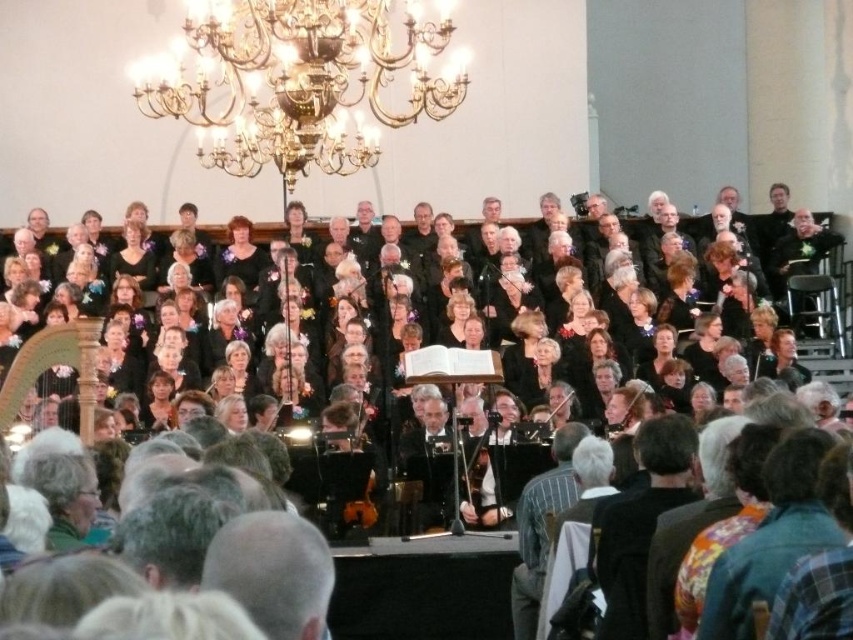
Is gold crystal chandelier at upper center taller than black leather jacket at upper center?

Correct, gold crystal chandelier at upper center is much taller as black leather jacket at upper center.

Is gold crystal chandelier at upper center bigger than black leather jacket at upper center?

Correct, gold crystal chandelier at upper center is larger in size than black leather jacket at upper center.

Is point (143, 92) positioned after point (805, 240)?

That is False.

This screenshot has width=853, height=640. In order to click on gold crystal chandelier at upper center in this screenshot , I will do `click(297, 81)`.

Between gold crystal chandelier at upper center and short hair at center, which one has more height?

gold crystal chandelier at upper center

Which of these two, gold crystal chandelier at upper center or short hair at center, stands shorter?

With less height is short hair at center.

Is point (171, 54) closer to camera compared to point (262, 600)?

No, (171, 54) is further to viewer.

Identify the location of gold crystal chandelier at upper center. click(x=297, y=81).

Does gold crystal chandelier at upper center lie behind striped fabric at center?

Yes, gold crystal chandelier at upper center is further from the viewer.

Describe the element at coordinates (297, 81) in the screenshot. I see `gold crystal chandelier at upper center` at that location.

The image size is (853, 640). In order to click on gold crystal chandelier at upper center in this screenshot , I will do `click(297, 81)`.